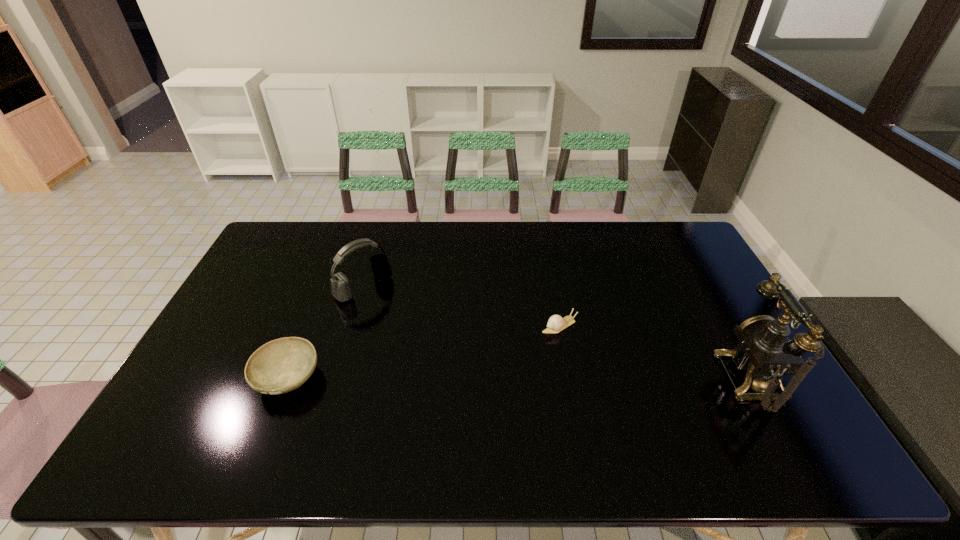
In the image, there is a desktop. Where is `vacant space at the left edge`? The image size is (960, 540). vacant space at the left edge is located at coordinates coord(279,288).

The image size is (960, 540). Find the location of `blank space at the far left corner of the desktop`. blank space at the far left corner of the desktop is located at coordinates (291, 223).

You are a GUI agent. You are given a task and a screenshot of the screen. Output one action in this format:
    pyautogui.click(x=<x>, y=<y>)
    Task: Click on the vacant space at the far right corner
    This screenshot has width=960, height=540.
    Given the screenshot: What is the action you would take?
    pyautogui.click(x=647, y=222)

In order to click on free space between the farthest object and the tallest object in this screenshot , I will do `click(559, 333)`.

Where is `blank region between the bowl and the third shortest object`? The height and width of the screenshot is (540, 960). blank region between the bowl and the third shortest object is located at coordinates (325, 333).

Locate an element on the screen. This screenshot has height=540, width=960. free space that is in between the farthest object and the second farthest object is located at coordinates (462, 307).

This screenshot has width=960, height=540. What are the coordinates of `empty location between the tallest object and the shortest object` in the screenshot? It's located at (657, 352).

The height and width of the screenshot is (540, 960). I want to click on empty location between the second farthest object and the tallest object, so click(657, 352).

Identify the location of vacant space that's between the telephone and the escargot. (657, 352).

At what (x,y) coordinates should I click in order to perform the action: click on vacant space that's between the telephone and the headset. Please return your answer as a coordinate pair (x, y). The image size is (960, 540). Looking at the image, I should click on (559, 333).